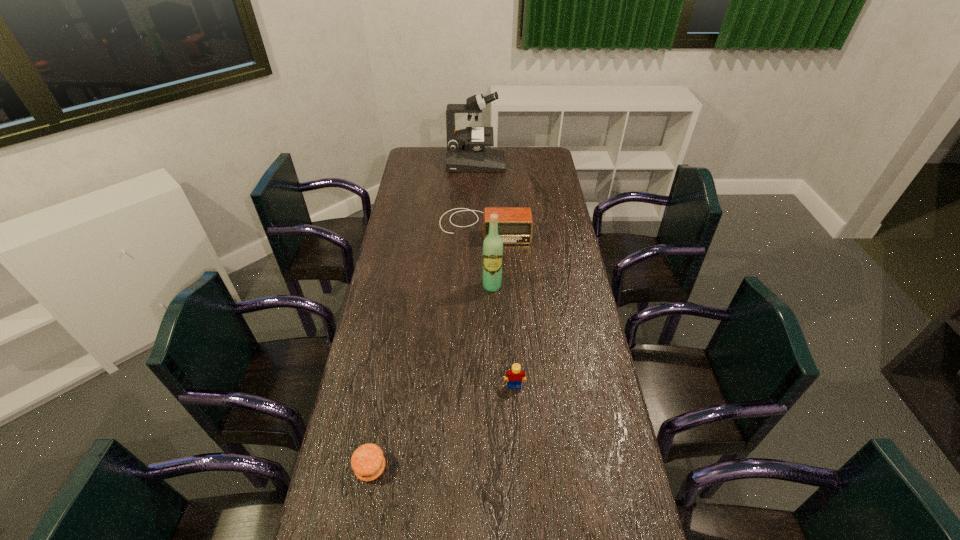
Locate an element on the screen. Image resolution: width=960 pixels, height=540 pixels. empty space between the radio receiver and the patty is located at coordinates (x=427, y=347).

At what (x,y) coordinates should I click in order to perform the action: click on free space between the farthest object and the radio receiver. Please return your answer as a coordinate pair (x, y). The image size is (960, 540). Looking at the image, I should click on (480, 195).

The height and width of the screenshot is (540, 960). I want to click on free point between the fourth farthest object and the third farthest object, so click(x=503, y=336).

Locate an element on the screen. free space between the Lego and the third nearest object is located at coordinates (503, 336).

Where is `free spot between the third farthest object and the patty`? This screenshot has width=960, height=540. free spot between the third farthest object and the patty is located at coordinates (431, 377).

Identify the location of object that is the fourth closest to the second farthest object. (368, 462).

Identify the location of the closest object relative to the nearest object. The height and width of the screenshot is (540, 960). (515, 376).